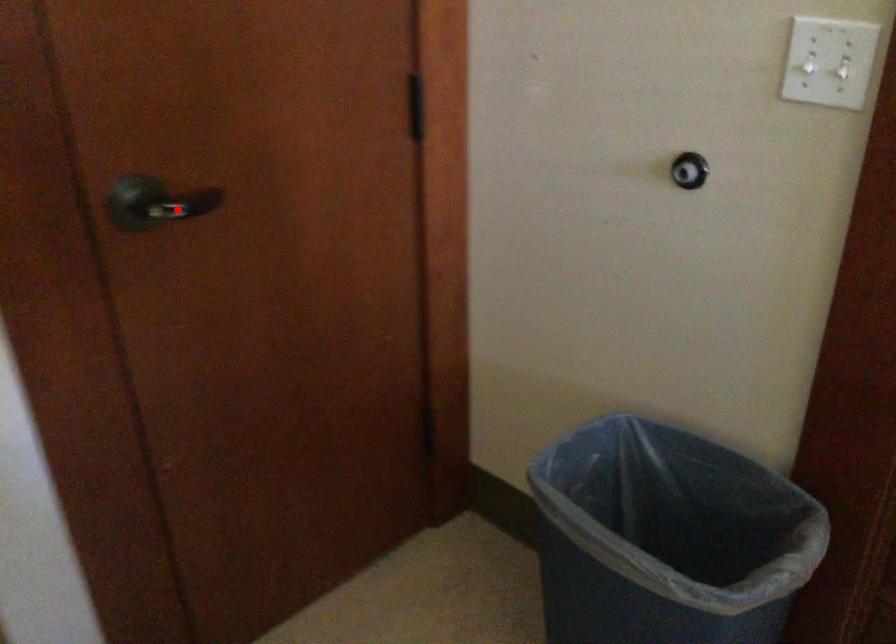
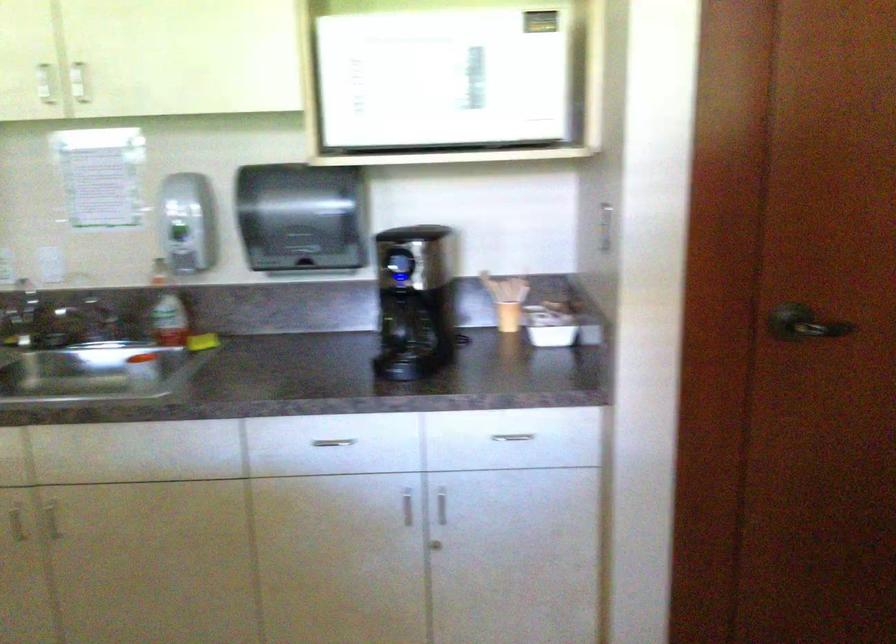
Question: I am providing you with two images of the same scene from different viewpoints. A red point is shown in image1. For the corresponding object point in image2, is it positioned nearer or farther from the camera?

Choices:
 (A) Nearer
 (B) Farther

Answer: (B)